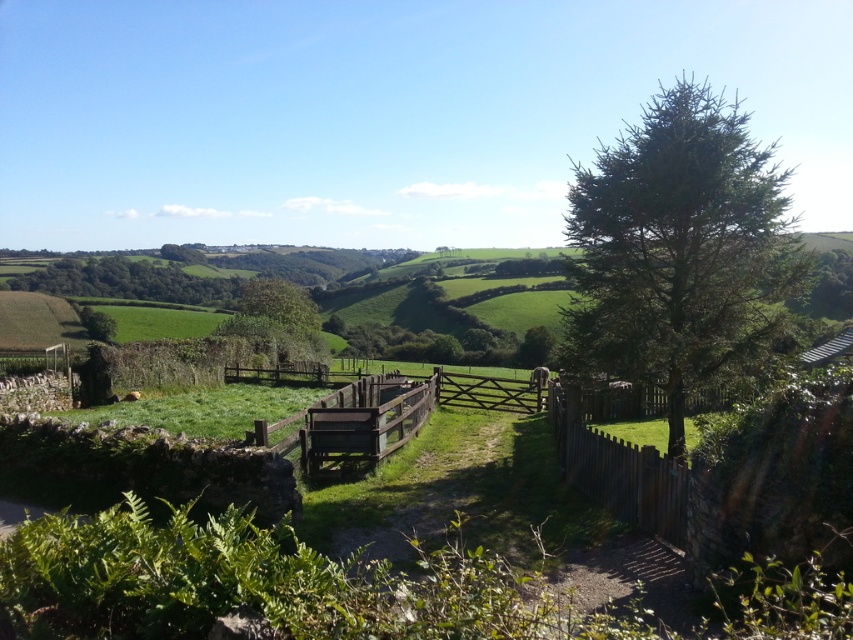
Does brown wooden fence at right appear on the right side of green leafy tree at left?

Indeed, brown wooden fence at right is positioned on the right side of green leafy tree at left.

Between brown wooden fence at right and green leafy tree at left, which one has more height?

With more height is green leafy tree at left.

Is point (549, 396) farther from camera compared to point (79, 294)?

No.

At what (x,y) coordinates should I click in order to perform the action: click on brown wooden fence at right. Please return your answer as a coordinate pair (x, y). Looking at the image, I should click on tap(619, 470).

Does green needle-like tree at right appear under brown wooden fence at right?

Actually, green needle-like tree at right is above brown wooden fence at right.

The image size is (853, 640). What are the coordinates of `green needle-like tree at right` in the screenshot? It's located at (679, 248).

Does brown wooden fence at center appear over green leafy tree at center?

No.

Between point (424, 410) and point (241, 291), which one is positioned behind?

Point (241, 291)

Is point (308, 428) positioned after point (312, 321)?

That is False.

Find the location of `brown wooden fence at center`. brown wooden fence at center is located at coordinates (352, 420).